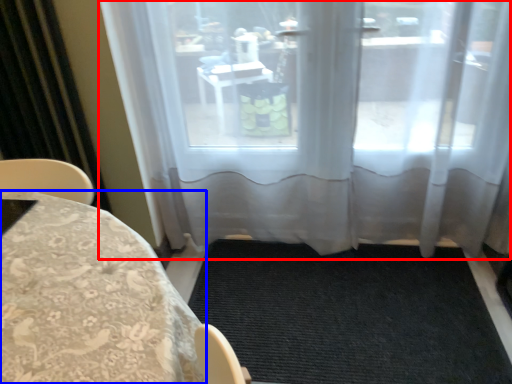
Question: Which object appears closest to the camera in this image, window (highlighted by a red box) or furniture (highlighted by a blue box)?

Choices:
 (A) window
 (B) furniture

Answer: (B)